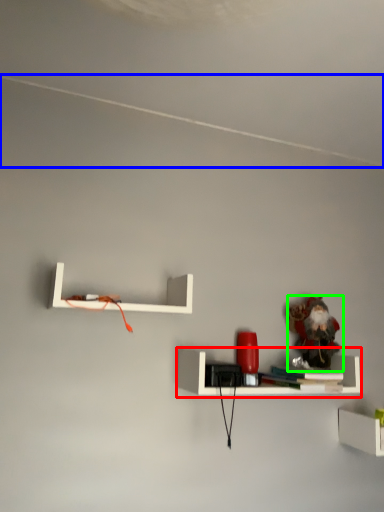
Question: Considering the real-world distances, which object is farthest from shelf (highlighted by a red box)? line (highlighted by a blue box) or toy (highlighted by a green box)?

Choices:
 (A) line
 (B) toy

Answer: (A)